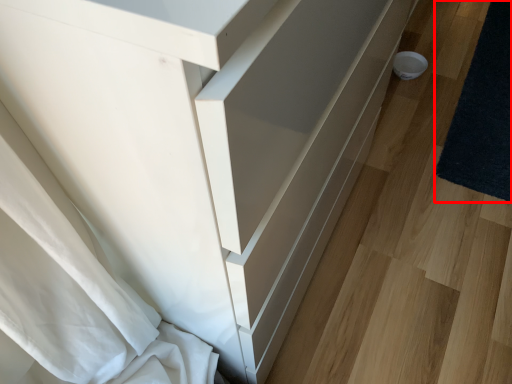
Question: Observing the image, what is the correct spatial positioning of mat (annotated by the red box) in reference to drawer?

Choices:
 (A) left
 (B) right

Answer: (B)